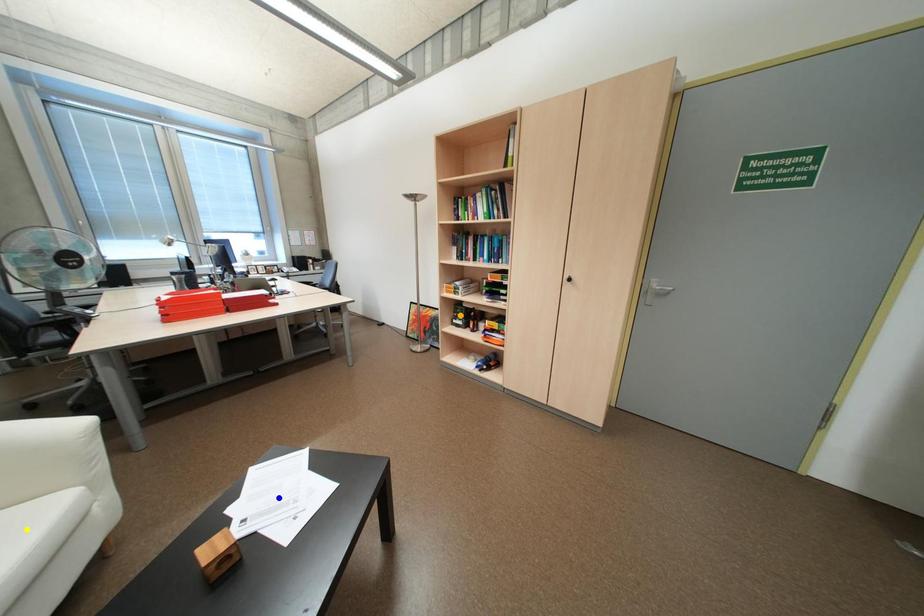
Order these from farthest to nearest:
yellow point | orange point | blue point

orange point → blue point → yellow point